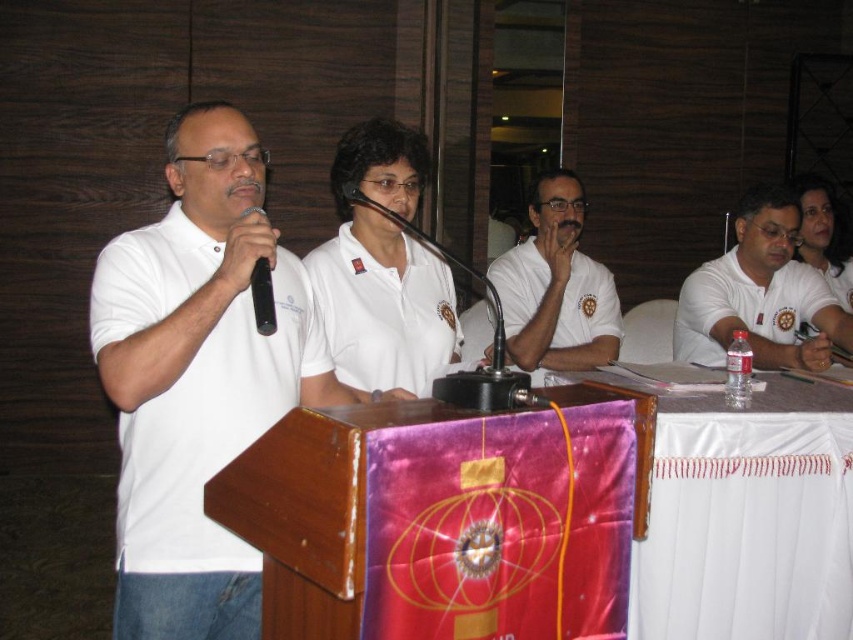
Does point (135, 300) lie in front of point (254, 312)?

No, it is not.

Looking at this image, between white matte polo shirt at left and black plastic microphone at left, which one appears on the right side from the viewer's perspective?

Positioned to the right is black plastic microphone at left.

Which is behind, point (201, 472) or point (267, 308)?

Point (201, 472)

The image size is (853, 640). Identify the location of white matte polo shirt at left. (212, 429).

Is white matte shirt at right closer to camera compared to black plastic microphone at left?

No.

Who is positioned more to the left, white matte shirt at right or black plastic microphone at left?

black plastic microphone at left is more to the left.

Is point (741, 285) positioned behind point (271, 288)?

Yes.

You are a GUI agent. You are given a task and a screenshot of the screen. Output one action in this format:
    pyautogui.click(x=<x>, y=<y>)
    Task: Click on the white matte shirt at right
    This screenshot has width=853, height=640.
    Given the screenshot: What is the action you would take?
    pyautogui.click(x=759, y=294)

Does white matte polo shirt at left have a larger size compared to white matte shirt at center?

Incorrect, white matte polo shirt at left is not larger than white matte shirt at center.

Looking at this image, how much distance is there between white matte polo shirt at left and white matte shirt at center?

white matte polo shirt at left and white matte shirt at center are 3.57 feet apart.

Find the location of a particular element. Image resolution: width=853 pixels, height=640 pixels. white matte polo shirt at left is located at coordinates (212, 429).